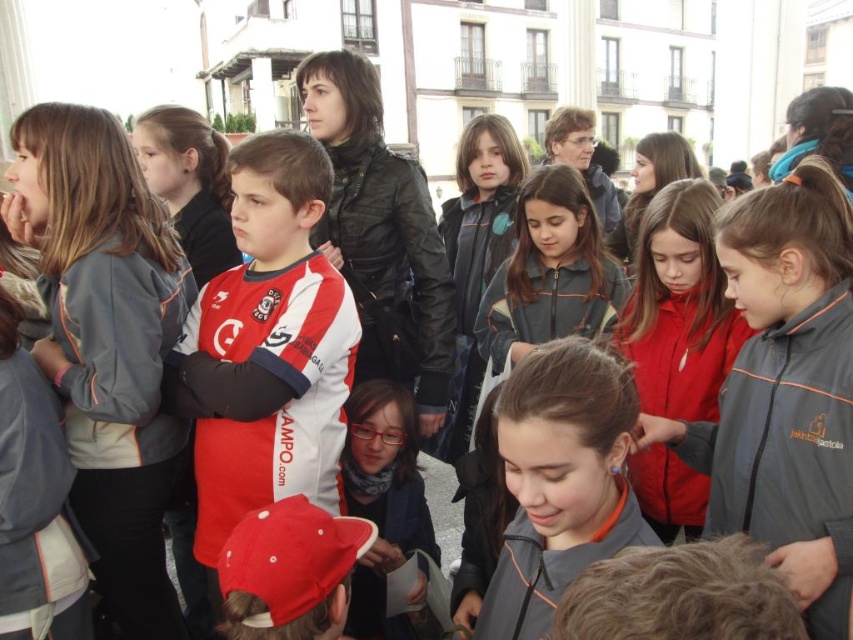
You are a photographer trying to capture the gray fleece jacket at left in the image. The camera is set to focus at point coordinates of 0.5, 0.1. Will the jacket be in focus?

The gray fleece jacket at left is located at point coordinates of (107, 342), which is very close to the camera focus point of (84, 320). Therefore, the jacket will be in focus.

You are a photographer trying to capture a group photo of the children in the public square. You notice the red and white jersey at center and the gray matte jacket at center. Which clothing item should you focus on to ensure it stands out more in the photo?

The red and white jersey at center has a larger size compared to the gray matte jacket at center, so focusing on the red and white jersey at center would make it stand out more in the photo due to its larger size.